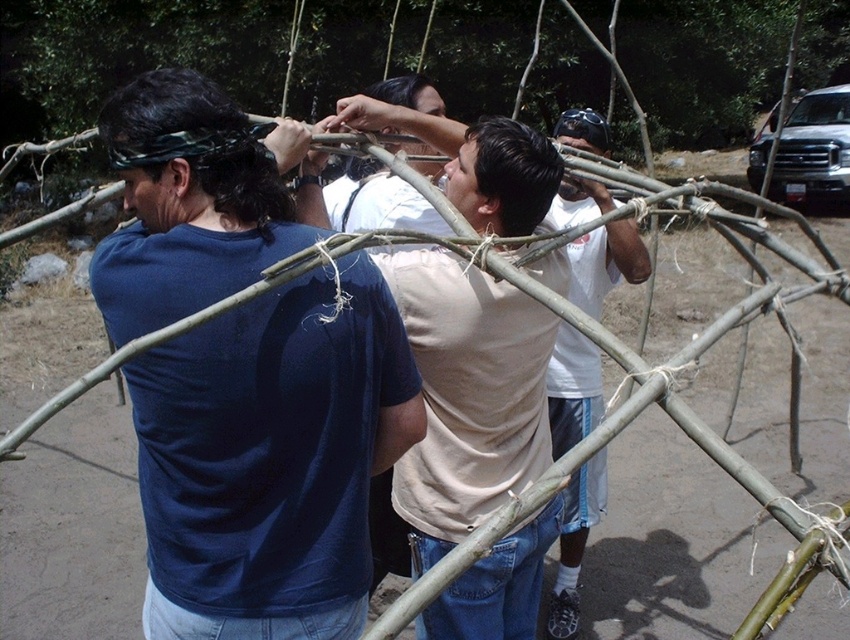
Is matte blue t-shirt at left shorter than white cotton t-shirt at center?

Yes.

What do you see at coordinates (272, 458) in the screenshot?
I see `matte blue t-shirt at left` at bounding box center [272, 458].

Find the location of a particular element. The height and width of the screenshot is (640, 850). matte blue t-shirt at left is located at coordinates (272, 458).